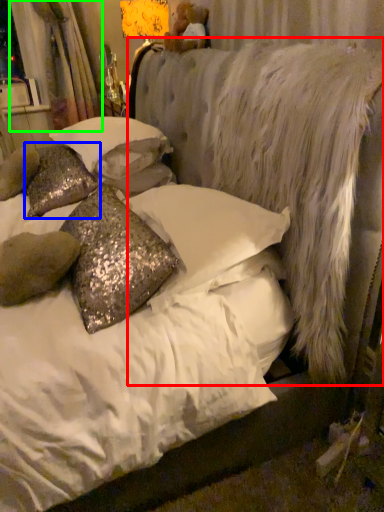
Question: Which is farther away from mattress (highlighted by a red box)? pillow (highlighted by a blue box) or curtain (highlighted by a green box)?

Choices:
 (A) pillow
 (B) curtain

Answer: (B)